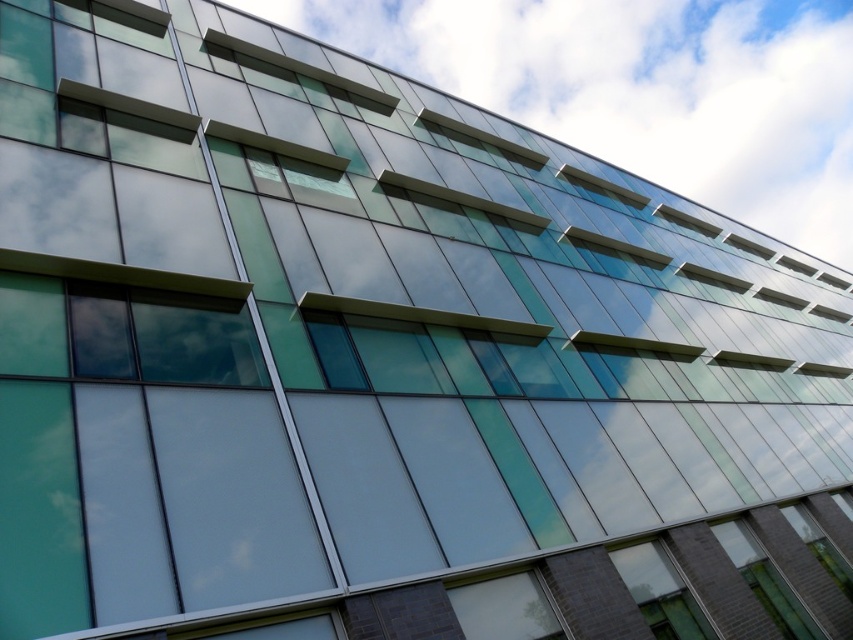
You are an architect reviewing the building facade. You notice two transparent glass windows, the transparent glass window at upper center and the transparent glass window at upper right. Which one is positioned more to the left side of the building?

The transparent glass window at upper center is positioned more to the left side of the building compared to the transparent glass window at upper right.

You are standing 10 feet away from the building. You want to touch both the transparent glass window at lower right and the transparent glass window at upper center. What is the minimum distance you need to walk to reach both windows?

The minimum distance you need to walk is 48.14 feet plus 10 feet, totaling 58.14 feet.